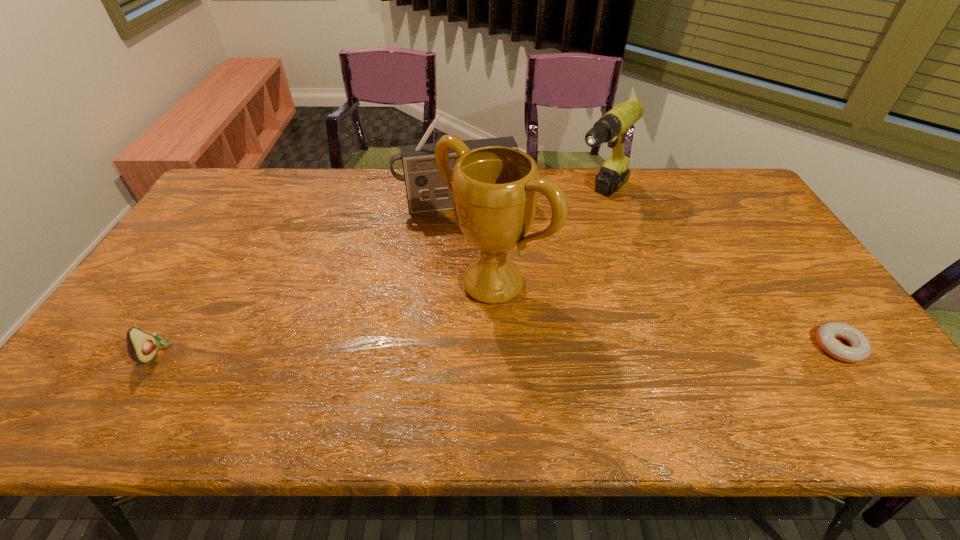
The width and height of the screenshot is (960, 540). I want to click on blank space located on the front panel of the radio receiver, so click(x=479, y=261).

The height and width of the screenshot is (540, 960). I want to click on vacant space situated on the front panel of the radio receiver, so click(471, 235).

Locate an element on the screen. vacant space situated on the front panel of the radio receiver is located at coordinates (481, 271).

Where is `free space located on the front of the tallest object with the decoration`? free space located on the front of the tallest object with the decoration is located at coordinates (389, 364).

Where is `vacant space situated 0.190m on the front of the tallest object with the decoration`? The width and height of the screenshot is (960, 540). vacant space situated 0.190m on the front of the tallest object with the decoration is located at coordinates (398, 356).

This screenshot has width=960, height=540. I want to click on vacant position located on the front of the tallest object with the decoration, so click(x=415, y=343).

The height and width of the screenshot is (540, 960). Find the location of `vacant space located 0.130m on the handle side of the drill`. vacant space located 0.130m on the handle side of the drill is located at coordinates (563, 234).

Image resolution: width=960 pixels, height=540 pixels. Find the location of `vacant space positioned on the handle side of the drill`. vacant space positioned on the handle side of the drill is located at coordinates (516, 278).

Find the location of a particular element. vacant space situated 0.100m on the handle side of the drill is located at coordinates (568, 229).

You are a GUI agent. You are given a task and a screenshot of the screen. Output one action in this format:
    pyautogui.click(x=<x>, y=<y>)
    Task: Click on the radio receiver that is positioned at the far edge
    Image resolution: width=960 pixels, height=540 pixels.
    Given the screenshot: What is the action you would take?
    pos(426,191)